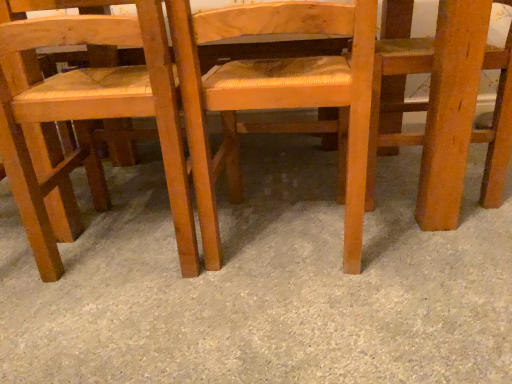
In order to face gray carpet at center, should I rotate leftwards or rightwards?

You should look right and rotate roughly 2.374 degrees.

What are the coordinates of `wooden chair at right, arranged as the 3th chair when viewed from the left` in the screenshot? It's located at (401, 53).

The image size is (512, 384). What do you see at coordinates (274, 96) in the screenshot? I see `wooden chair at center, the 2th chair viewed from the right` at bounding box center [274, 96].

Where is `wooden woven seat at left, which ranks as the first chair in left-to-right order`? wooden woven seat at left, which ranks as the first chair in left-to-right order is located at coordinates (99, 95).

Is gray carpet at center oriented away from wooden chair at right, the 1th chair positioned from the right?

No, gray carpet at center's orientation is not away from wooden chair at right, the 1th chair positioned from the right.

Are gray carpet at center and wooden chair at right, the 1th chair positioned from the right, located far from each other?

That's not correct — gray carpet at center is a little close to wooden chair at right, the 1th chair positioned from the right.

Which object is closer to the camera taking this photo, gray carpet at center or wooden chair at right, arranged as the 3th chair when viewed from the left?

gray carpet at center.

There is a gray carpet at center. At what (x,y) coordinates should I click in order to perform the action: click on the 3rd chair above it (from the image's perspective). Please return your answer as a coordinate pair (x, y). The height and width of the screenshot is (384, 512). Looking at the image, I should click on (401, 53).

Based on the photo, does gray carpet at center have a lesser height compared to wooden chair at center, the 2th chair viewed from the right?

Yes.

From the image's perspective, between gray carpet at center and wooden chair at center, which ranks as the 2th chair in left-to-right order, which one is located above?

wooden chair at center, which ranks as the 2th chair in left-to-right order, is shown above in the image.

Could wooden chair at center, which ranks as the 2th chair in left-to-right order, be considered to be inside gray carpet at center?

Definitely not — wooden chair at center, which ranks as the 2th chair in left-to-right order, is not inside gray carpet at center.

What's the angular difference between gray carpet at center and wooden chair at center, which ranks as the 2th chair in left-to-right order,'s facing directions?

The facing directions of gray carpet at center and wooden chair at center, which ranks as the 2th chair in left-to-right order, are 85.6 degrees apart.

Looking at this image, who is bigger, wooden woven seat at left, which ranks as the first chair in left-to-right order, or wooden chair at right, arranged as the 3th chair when viewed from the left?

wooden woven seat at left, which ranks as the first chair in left-to-right order, is bigger.

Is wooden woven seat at left, which ranks as the first chair in left-to-right order, facing towards wooden chair at right, the 1th chair positioned from the right?

No, wooden woven seat at left, which ranks as the first chair in left-to-right order, is not aimed at wooden chair at right, the 1th chair positioned from the right.

Which is less distant, (86,162) or (410,22)?

Point (86,162) is positioned closer to the camera compared to point (410,22).

From a real-world perspective, which object stands above the other?

wooden woven seat at left, the 3th chair in the right-to-left sequence, is physically above.

Is point (205, 151) positioned after point (88, 154)?

That is False.

Does wooden chair at center, which ranks as the 2th chair in left-to-right order, have a smaller size compared to wooden woven seat at left, the 3th chair in the right-to-left sequence?

Indeed, wooden chair at center, which ranks as the 2th chair in left-to-right order, has a smaller size compared to wooden woven seat at left, the 3th chair in the right-to-left sequence.

Which object is closer to the camera taking this photo, wooden chair at center, which ranks as the 2th chair in left-to-right order, or wooden woven seat at left, which ranks as the first chair in left-to-right order?

wooden chair at center, which ranks as the 2th chair in left-to-right order, is more forward.

Are wooden woven seat at left, which ranks as the first chair in left-to-right order, and gray carpet at center making contact?

No, wooden woven seat at left, which ranks as the first chair in left-to-right order, is not next to gray carpet at center.

Locate an element on the screen. concrete on the right of wooden woven seat at left, which ranks as the first chair in left-to-right order is located at coordinates (265, 285).

Would you say wooden woven seat at left, which ranks as the first chair in left-to-right order, contains gray carpet at center?

That's incorrect, gray carpet at center is not inside wooden woven seat at left, which ranks as the first chair in left-to-right order.

In terms of width, does wooden woven seat at left, the 3th chair in the right-to-left sequence, look wider or thinner when compared to gray carpet at center?

Clearly, wooden woven seat at left, the 3th chair in the right-to-left sequence, has less width compared to gray carpet at center.

Is gray carpet at center taller or shorter than wooden woven seat at left, which ranks as the first chair in left-to-right order?

Clearly, gray carpet at center is shorter compared to wooden woven seat at left, which ranks as the first chair in left-to-right order.

Is gray carpet at center next to wooden woven seat at left, which ranks as the first chair in left-to-right order?

Result: gray carpet at center and wooden woven seat at left, which ranks as the first chair in left-to-right order, are clearly separated.

The image size is (512, 384). I want to click on chair that is the 3rd object above the gray carpet at center (from a real-world perspective), so click(99, 95).

Is gray carpet at center inside or outside of wooden woven seat at left, the 3th chair in the right-to-left sequence?

gray carpet at center lies outside wooden woven seat at left, the 3th chair in the right-to-left sequence.

Can you confirm if wooden chair at right, the 1th chair positioned from the right, is wider than wooden chair at center, the 2th chair viewed from the right?

No.

Is point (500, 95) in front of point (364, 197)?

No, (500, 95) is further to viewer.

Would you consider wooden chair at right, the 1th chair positioned from the right, to be distant from wooden chair at center, the 2th chair viewed from the right?

No, there isn't a large distance between wooden chair at right, the 1th chair positioned from the right, and wooden chair at center, the 2th chair viewed from the right.

Starting from the gray carpet at center, which chair is the 3rd one behind? Please provide its 2D coordinates.

[(401, 53)]

You are a GUI agent. You are given a task and a screenshot of the screen. Output one action in this format:
    pyautogui.click(x=<x>, y=<y>)
    Task: Click on the concrete on the left side of wooden chair at center, the 2th chair viewed from the right
    This screenshot has width=512, height=384.
    Given the screenshot: What is the action you would take?
    pyautogui.click(x=265, y=285)

Based on their spatial positions, is gray carpet at center or wooden chair at right, arranged as the 3th chair when viewed from the left, further from wooden chair at center, which ranks as the 2th chair in left-to-right order?

wooden chair at right, arranged as the 3th chair when viewed from the left, is further to wooden chair at center, which ranks as the 2th chair in left-to-right order.

Looking at the image, which one is located further to wooden chair at center, which ranks as the 2th chair in left-to-right order, wooden chair at right, arranged as the 3th chair when viewed from the left, or wooden woven seat at left, which ranks as the first chair in left-to-right order?

The object further to wooden chair at center, which ranks as the 2th chair in left-to-right order, is wooden chair at right, arranged as the 3th chair when viewed from the left.

Estimate the real-world distances between objects in this image. Which object is further from wooden woven seat at left, the 3th chair in the right-to-left sequence, gray carpet at center or wooden chair at right, the 1th chair positioned from the right?

Among the two, wooden chair at right, the 1th chair positioned from the right, is located further to wooden woven seat at left, the 3th chair in the right-to-left sequence.

Considering their positions, is wooden chair at right, arranged as the 3th chair when viewed from the left, positioned closer to wooden woven seat at left, the 3th chair in the right-to-left sequence, than wooden chair at center, the 2th chair viewed from the right?

Among the two, wooden chair at center, the 2th chair viewed from the right, is located nearer to wooden woven seat at left, the 3th chair in the right-to-left sequence.

Considering their positions, is wooden chair at center, which ranks as the 2th chair in left-to-right order, positioned further to wooden chair at right, the 1th chair positioned from the right, than gray carpet at center?

gray carpet at center.

Estimate the real-world distances between objects in this image. Which object is closer to wooden woven seat at left, the 3th chair in the right-to-left sequence, wooden chair at center, which ranks as the 2th chair in left-to-right order, or gray carpet at center?

wooden chair at center, which ranks as the 2th chair in left-to-right order, is positioned closer to the anchor wooden woven seat at left, the 3th chair in the right-to-left sequence.

When comparing their distances from wooden chair at center, the 2th chair viewed from the right, does wooden woven seat at left, the 3th chair in the right-to-left sequence, or gray carpet at center seem further?

The object further to wooden chair at center, the 2th chair viewed from the right, is gray carpet at center.

Which object lies further to the anchor point wooden woven seat at left, the 3th chair in the right-to-left sequence, gray carpet at center or wooden chair at center, which ranks as the 2th chair in left-to-right order?

gray carpet at center lies further to wooden woven seat at left, the 3th chair in the right-to-left sequence, than the other object.

Image resolution: width=512 pixels, height=384 pixels. In order to click on concrete situated between wooden woven seat at left, the 3th chair in the right-to-left sequence, and wooden chair at center, the 2th chair viewed from the right, from left to right in this screenshot , I will do `click(265, 285)`.

At what (x,y) coordinates should I click in order to perform the action: click on chair situated between gray carpet at center and wooden chair at right, arranged as the 3th chair when viewed from the left, from left to right. Please return your answer as a coordinate pair (x, y). This screenshot has width=512, height=384. Looking at the image, I should click on (274, 96).

The width and height of the screenshot is (512, 384). I want to click on concrete situated between wooden woven seat at left, the 3th chair in the right-to-left sequence, and wooden chair at right, the 1th chair positioned from the right, from left to right, so click(x=265, y=285).

Where is `chair between wooden woven seat at left, which ranks as the first chair in left-to-right order, and wooden chair at right, arranged as the 3th chair when viewed from the left`? This screenshot has height=384, width=512. chair between wooden woven seat at left, which ranks as the first chair in left-to-right order, and wooden chair at right, arranged as the 3th chair when viewed from the left is located at coordinates (274, 96).